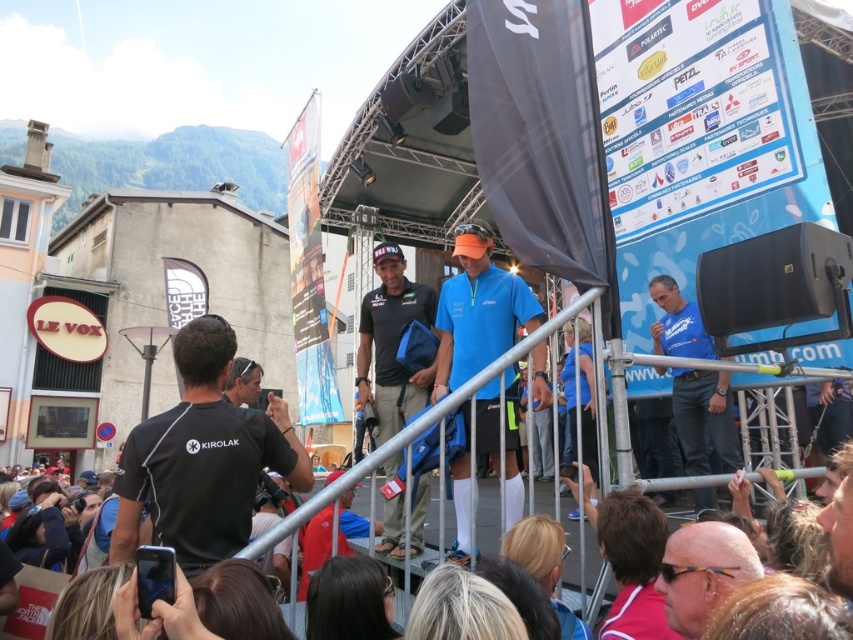
Who is taller, blue matte shirt at center or dark brown hair at lower center?

With more height is blue matte shirt at center.

Is point (512, 515) positioned in front of point (27, 572)?

Yes, point (512, 515) is in front of point (27, 572).

Where is `blue matte shirt at center`? The image size is (853, 640). blue matte shirt at center is located at coordinates pyautogui.click(x=479, y=310).

Consider the image. Who is higher up, blue fabric shirt at center or matte black sunglasses at lower right?

blue fabric shirt at center is higher up.

Is the position of blue fabric shirt at center less distant than that of matte black sunglasses at lower right?

No, blue fabric shirt at center is behind matte black sunglasses at lower right.

Identify the location of blue fabric shirt at center. This screenshot has height=640, width=853. (704, 419).

In order to click on blue fabric shirt at center in this screenshot , I will do `click(704, 419)`.

Does point (730, 547) come closer to viewer compared to point (248, 376)?

Yes, it is.

Who is more forward, (711, 609) or (242, 396)?

Point (711, 609)

The width and height of the screenshot is (853, 640). What do you see at coordinates (701, 572) in the screenshot?
I see `matte black sunglasses at lower right` at bounding box center [701, 572].

Identify the location of matte black sunglasses at lower right. This screenshot has height=640, width=853. (701, 572).